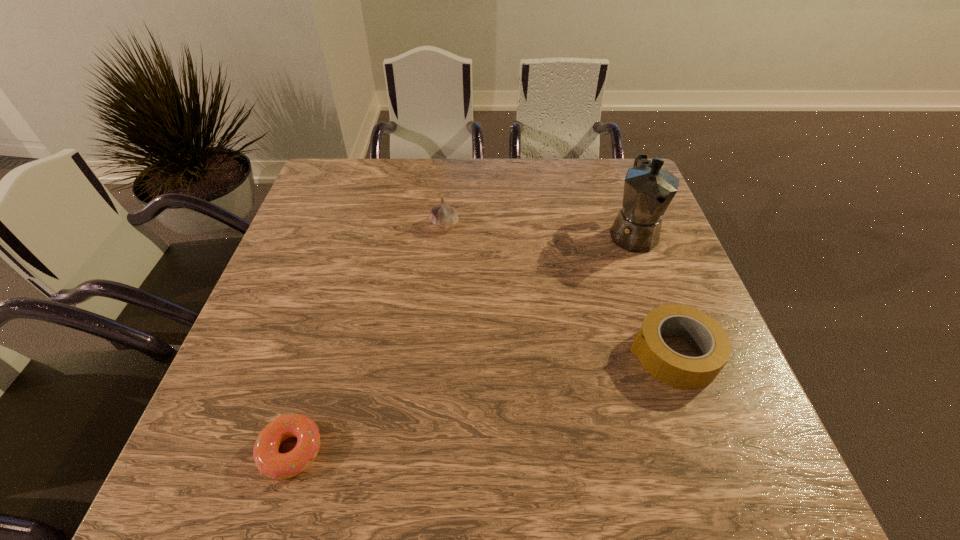
This screenshot has height=540, width=960. In order to click on vacant space at the left edge of the desktop in this screenshot , I will do `click(330, 258)`.

This screenshot has width=960, height=540. In the image, there is a desktop. Identify the location of blank space at the right edge. (706, 386).

Where is `vacant space at the far left corner of the desktop`? This screenshot has width=960, height=540. vacant space at the far left corner of the desktop is located at coordinates (347, 158).

The image size is (960, 540). I want to click on vacant position at the far right corner of the desktop, so click(622, 198).

At what (x,y) coordinates should I click in order to perform the action: click on free point between the tallest object and the second shortest object. Please return your answer as a coordinate pair (x, y). Looking at the image, I should click on (653, 294).

This screenshot has width=960, height=540. Identify the location of vacant area that lies between the tallest object and the duct tape. [653, 294].

Find the location of `free spot between the leftmost object and the duct tape`. free spot between the leftmost object and the duct tape is located at coordinates (483, 403).

What are the coordinates of `free space between the second object from left to right and the coffeepot` in the screenshot? It's located at (539, 229).

The height and width of the screenshot is (540, 960). Identify the location of free area in between the nearest object and the second shortest object. (483, 403).

I want to click on empty location between the third tallest object and the nearest object, so click(x=483, y=403).